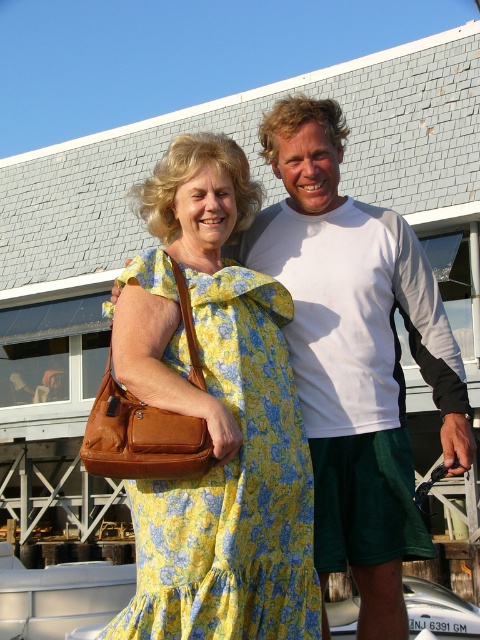
Which is more to the right, white matte t-shirt at upper center or yellow floral fabric dress at center?

From the viewer's perspective, white matte t-shirt at upper center appears more on the right side.

Does point (384, 412) come in front of point (232, 360)?

That is False.

Between point (359, 280) and point (269, 412), which one is positioned in front?

Positioned in front is point (269, 412).

Locate an element on the screen. white matte t-shirt at upper center is located at coordinates (356, 356).